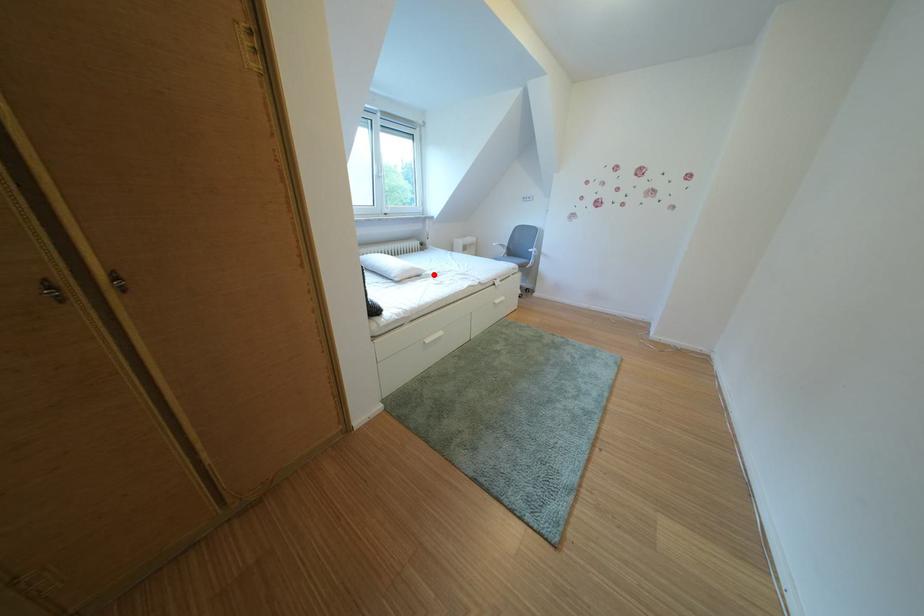
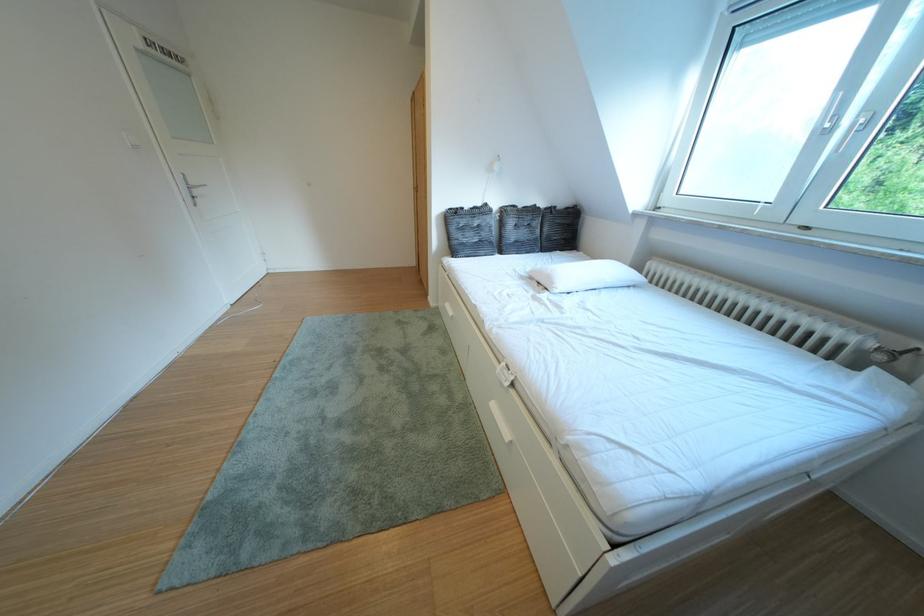
Where in the second image is the point corresponding to the highlighted location from the first image?

(565, 288)